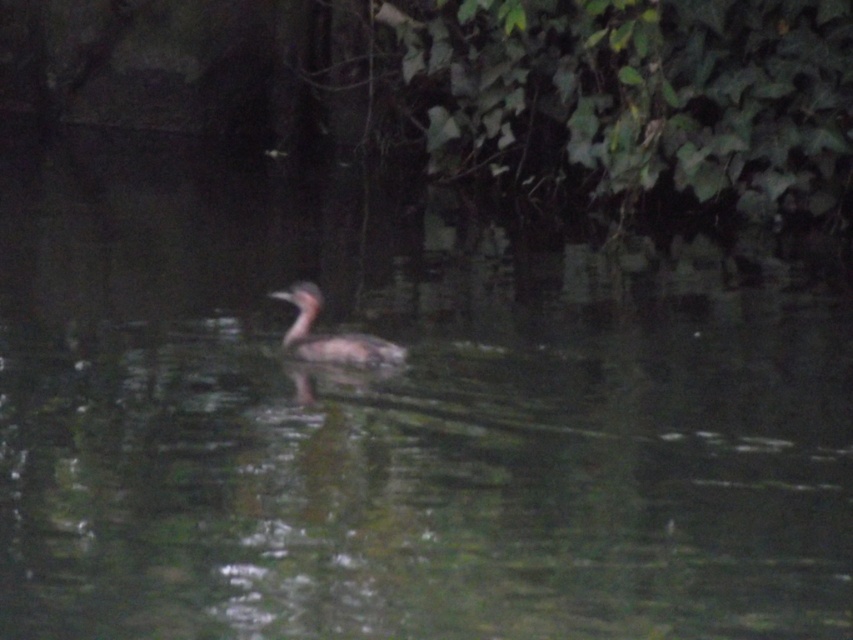
Question: Among these points, which one is nearest to the camera?

Choices:
 (A) (643, 35)
 (B) (300, 301)

Answer: (B)

Question: Is green leafy vegetation at upper right to the right of brown speckled duck at center from the viewer's perspective?

Choices:
 (A) yes
 (B) no

Answer: (A)

Question: Which point is closer to the camera?

Choices:
 (A) (584, 83)
 (B) (315, 353)

Answer: (B)

Question: Can you confirm if green leafy vegetation at upper right is positioned to the left of brown speckled duck at center?

Choices:
 (A) no
 (B) yes

Answer: (A)

Question: Does green leafy vegetation at upper right have a lesser width compared to brown speckled duck at center?

Choices:
 (A) no
 (B) yes

Answer: (A)

Question: Which object appears farthest from the camera in this image?

Choices:
 (A) brown speckled duck at center
 (B) green leafy vegetation at upper right

Answer: (B)